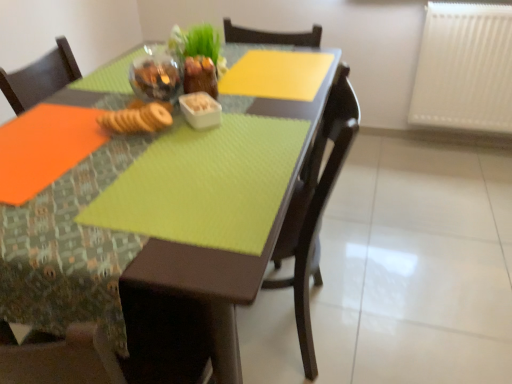
The width and height of the screenshot is (512, 384). Identify the location of vacant space underneath white plastic radiator at upper right (from a real-world perspective). click(x=451, y=140).